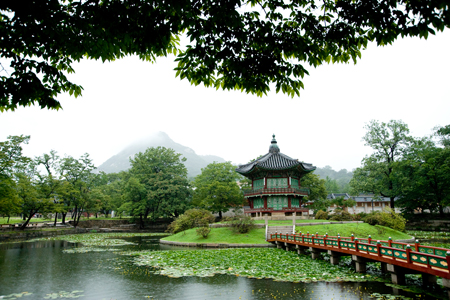
The width and height of the screenshot is (450, 300). Find the location of `stairs`. stairs is located at coordinates (279, 216).